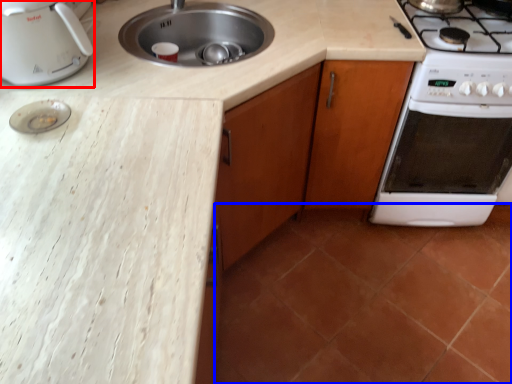
Question: Which object appears closest to the camera in this image, kitchen appliance (highlighted by a red box) or tile (highlighted by a blue box)?

Choices:
 (A) kitchen appliance
 (B) tile

Answer: (A)